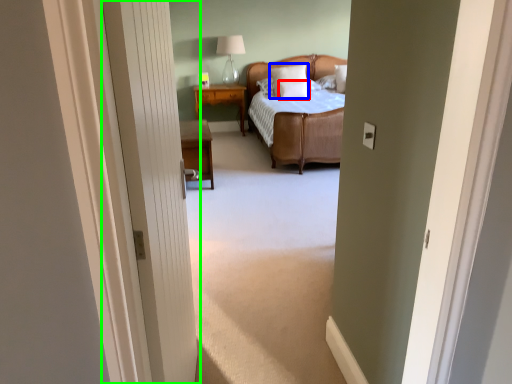
Question: Estimate the real-world distances between objects in this image. Which object is farther from pillow (highlighted by a red box), pillow (highlighted by a blue box) or door (highlighted by a green box)?

Choices:
 (A) pillow
 (B) door

Answer: (B)